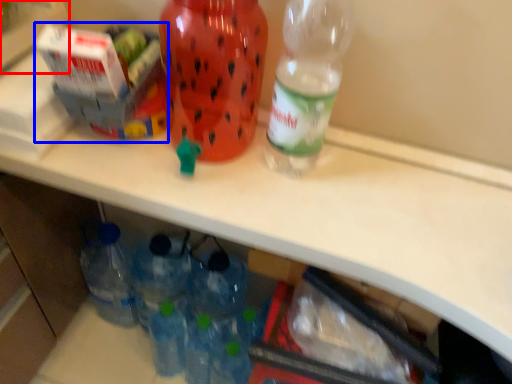
Question: Which object appears closest to the camera in this image, box (highlighted by a red box) or box (highlighted by a blue box)?

Choices:
 (A) box
 (B) box

Answer: (A)